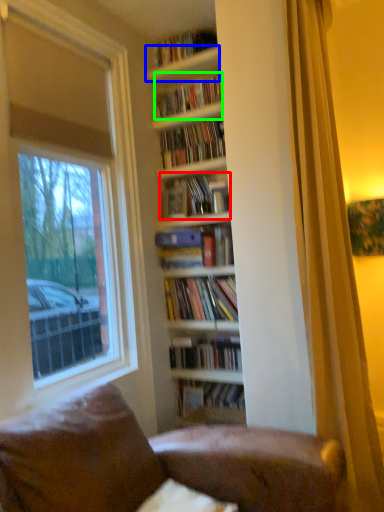
Question: Considering the real-world distances, which object is farthest from book (highlighted by a red box)? shelf (highlighted by a blue box) or book (highlighted by a green box)?

Choices:
 (A) shelf
 (B) book

Answer: (A)